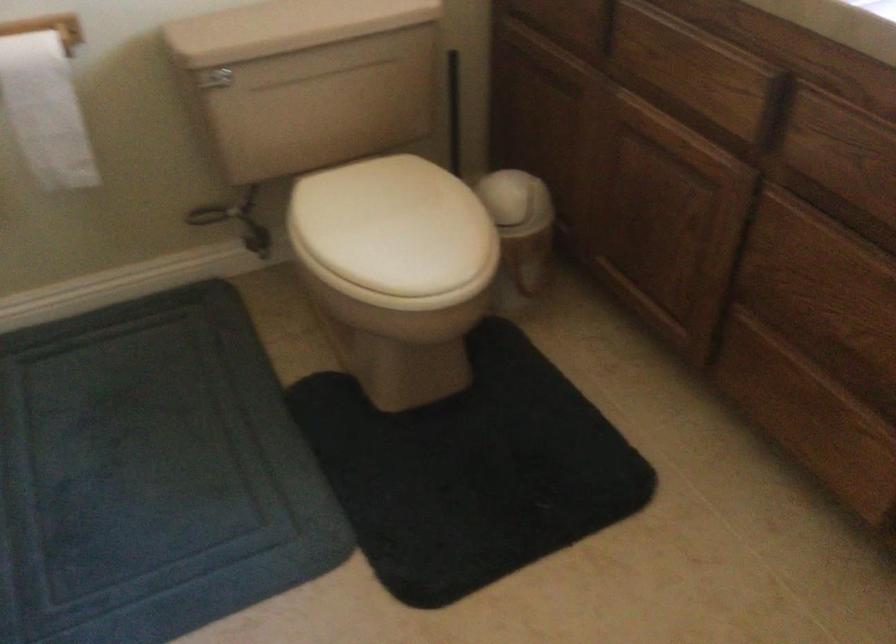
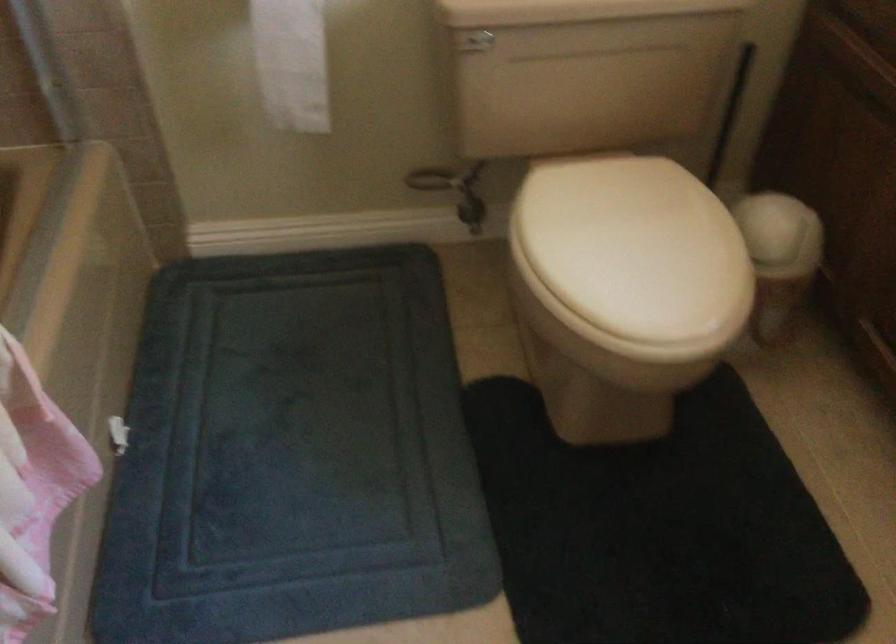
The point at (401, 227) is marked in the first image. Where is the corresponding point in the second image?

(634, 247)